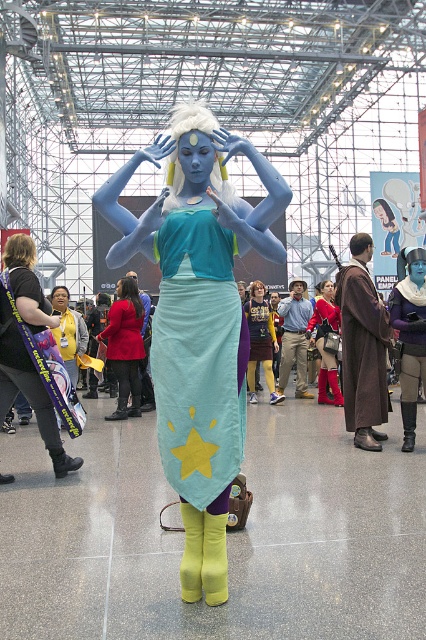
In the scene shown: You are an event organizer arranging a photo shoot in the convention space. You need to position the matte red coat at center and the matte blue skirt at center so that they are aligned symmetrically along the central axis of the room. Given their current positions, which item should you move to achieve this symmetry?

The matte red coat at center is currently to the left of the matte blue skirt at center. To align them symmetrically around the central axis, you should move the matte red coat at center to the right side of the central axis and the matte blue skirt at center to the left side, ensuring both are equidistant from the center but on opposite sides.

You are standing in the convention hall and see two points marked in the image. Which point is closer to you, point (327, 305) or point (81, 323)?

Point (327, 305) is closer to you because it is further to the viewer than point (81, 323).